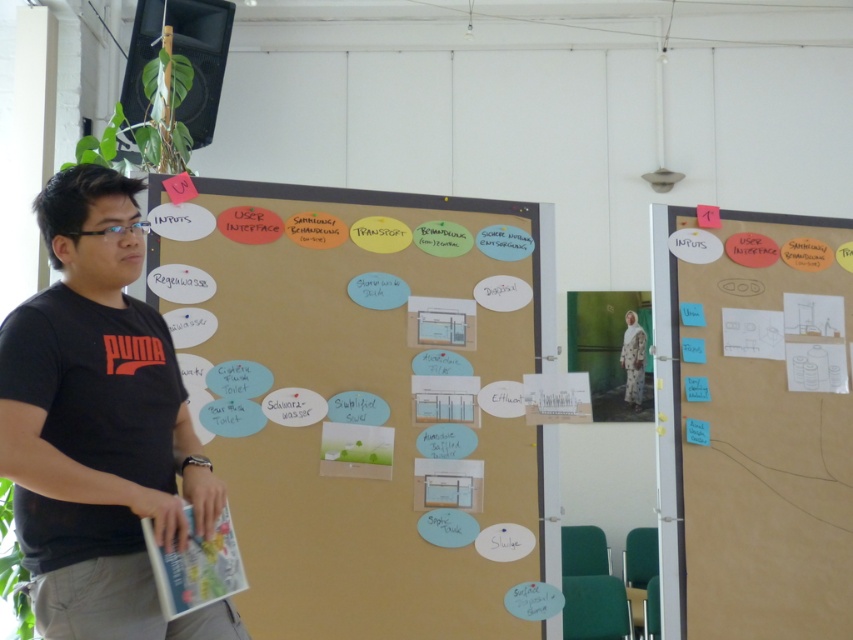
Based on the scene description, which object is wider? The brown paperboard at center or the white paperboard at right?

The brown paperboard at center is wider than the white paperboard at right.

You are organizing a presentation and need to place two paperboards in a row. The brown paperboard at center and the white paperboard at right must be arranged so that the taller one is on the left. Which paperboard should be placed on the left?

The white paperboard at right should be placed on the left because it is taller than the brown paperboard at center.

You are an architect designing a layout for a new office space. You need to place a desk and a whiteboard in such a way that they are both visible from the entrance. The desk should be positioned so that it faces the whiteboard. Given the coordinates of the brown paperboard at center at point 0.620, 0.424, where should you place the desk and whiteboard to ensure optimal visibility and alignment?

Since the brown paperboard at center is located at point (361, 396), the desk should be placed facing the whiteboard in a position that allows both to be visible from the entrance while maintaining alignment with the central coordinates provided.